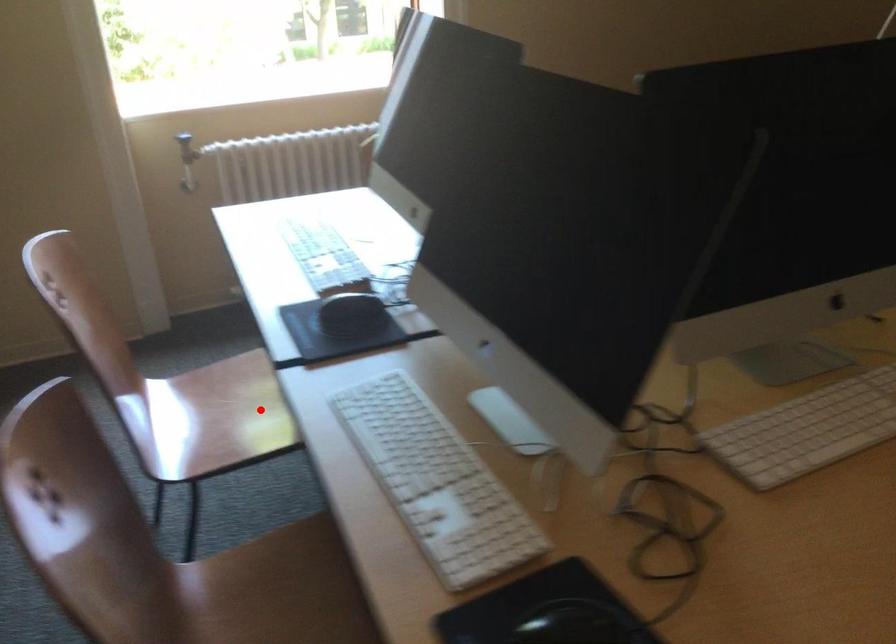
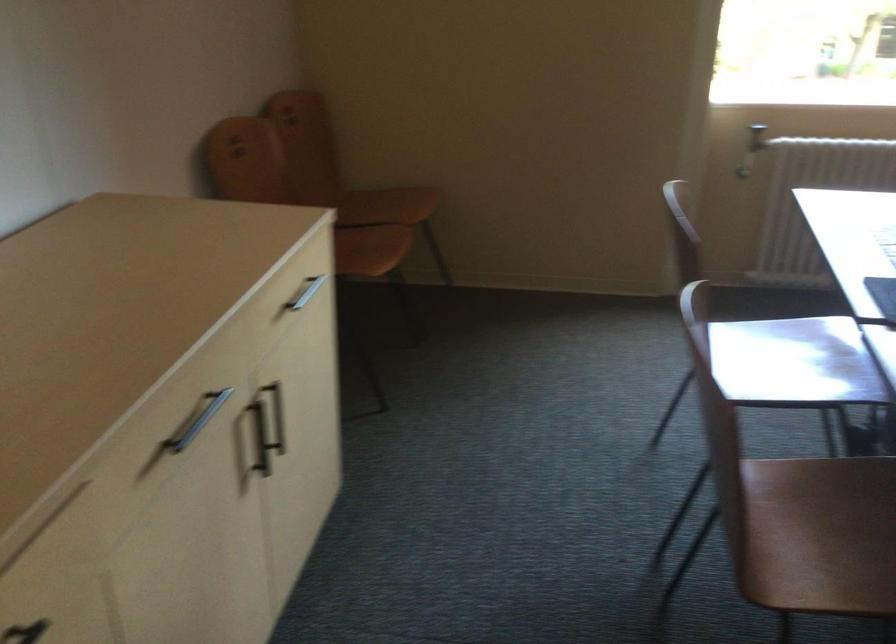
Question: I am providing you with two images of the same scene from different viewpoints. In image1, a red point is highlighted. Considering the same 3D point in image2, which of the following is correct?

Choices:
 (A) It is closer
 (B) It is farther

Answer: (B)